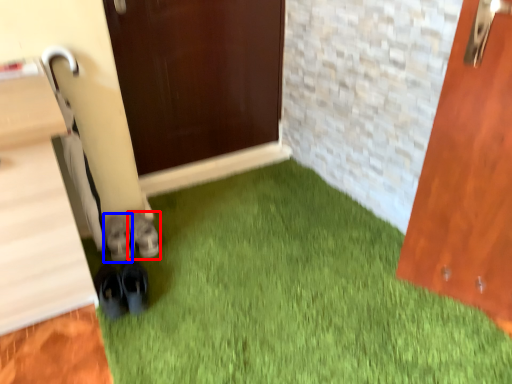
Question: Among these objects, which one is nearest to the camera, footwear (highlighted by a red box) or footwear (highlighted by a blue box)?

Choices:
 (A) footwear
 (B) footwear

Answer: (B)